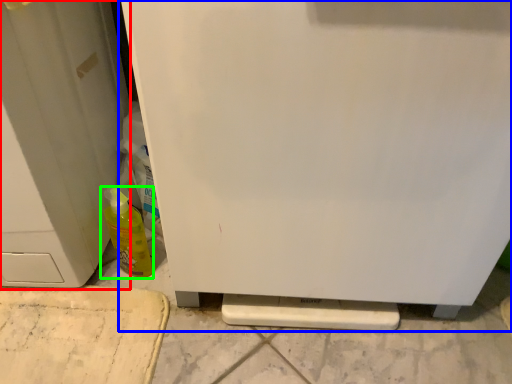
Question: Which is farther away from door (highlighted by a red box)? refrigerator (highlighted by a blue box) or bottle (highlighted by a green box)?

Choices:
 (A) refrigerator
 (B) bottle

Answer: (A)